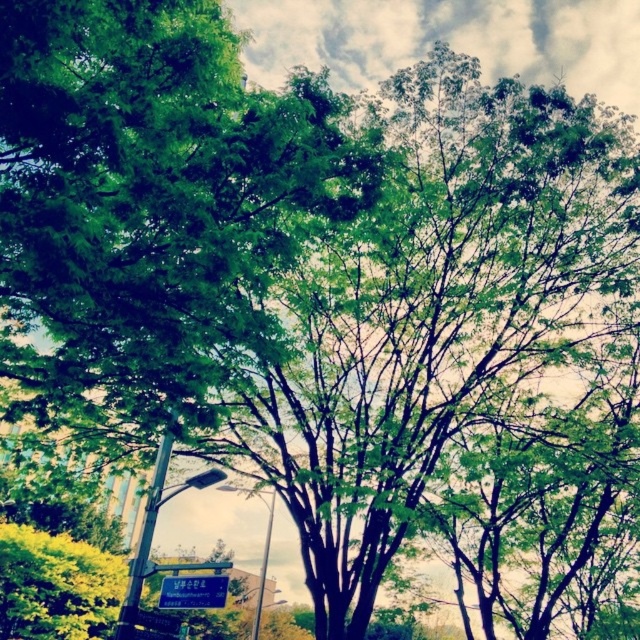
Looking at this image, you are a pedestrian walking along the path and see the metallic pole at left and the metallic pole at center. Which pole is closer to you?

The metallic pole at left is closer to you because it is in front of the metallic pole at center.

You are a pedestrian walking along the path and see the metallic pole at left and the metallic pole at center. Which pole is closer to you?

The metallic pole at left is closer to you because it is positioned over the metallic pole at center, meaning it is in front.